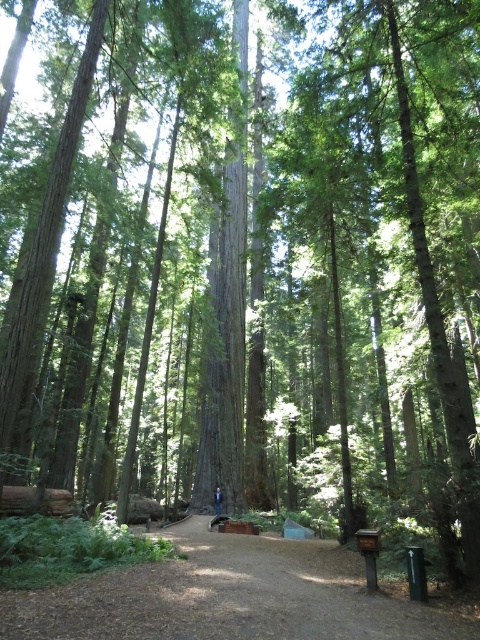
You are standing in the forest and see the brown dirt path at center and the blue jeans at center. Which object is positioned to the right of the other?

The brown dirt path at center is to the right of blue jeans at center.

You are standing in the forest and want to reach the point marked as point (284, 627). If you walk straight ahead, will you reach the point before the wooden platform?

The point (284, 627) is 3.07 meters from the camera, so yes, you will reach it before the wooden platform since it is closer than the platform.

From the picture: You are a hiker who wants to reach the wooden platform ahead. You see the brown dirt path at center and the blue jeans at center in the scene. Which object is closer to you as you stand at the starting point?

The brown dirt path at center is closer to you because it is in front of the blue jeans at center in the scene.